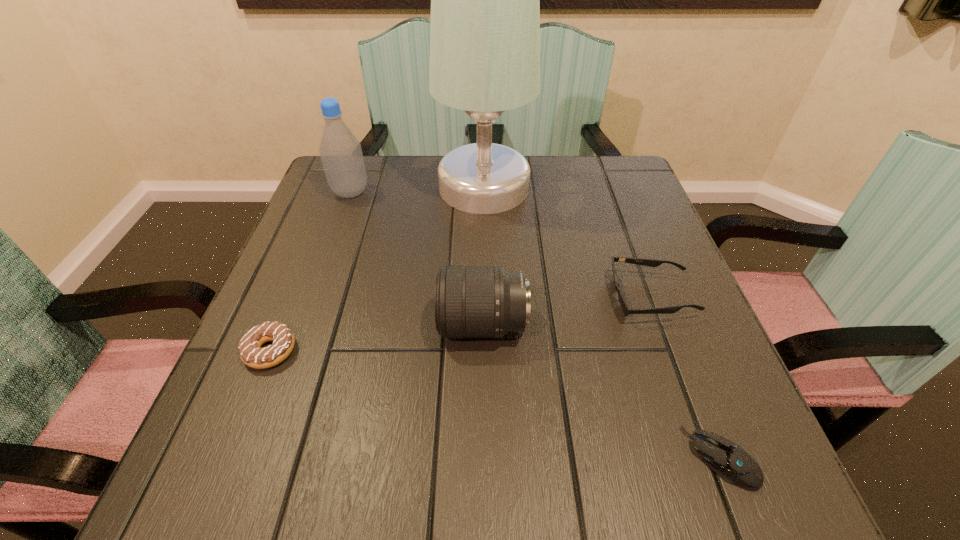
Image resolution: width=960 pixels, height=540 pixels. In the image, there is a desktop. In order to click on vacant space at the right edge in this screenshot , I will do `click(670, 293)`.

In the image, there is a desktop. Identify the location of blank space at the far left corner. The height and width of the screenshot is (540, 960). (313, 197).

Locate an element on the screen. The width and height of the screenshot is (960, 540). vacant space at the far right corner is located at coordinates (626, 205).

Locate an element on the screen. empty space that is in between the computer mouse and the tallest object is located at coordinates (602, 322).

Where is `free spot between the telephoto lens and the second tallest object`? The image size is (960, 540). free spot between the telephoto lens and the second tallest object is located at coordinates (417, 259).

At what (x,y) coordinates should I click in order to perform the action: click on vacant area that lies between the sunglasses and the nearest object. Please return your answer as a coordinate pair (x, y). Looking at the image, I should click on (685, 377).

Find the location of `vacant area that lies between the fourth tallest object and the tallest object`. vacant area that lies between the fourth tallest object and the tallest object is located at coordinates (567, 242).

Where is `vacant space that's between the second shortest object and the telephoto lens`? The height and width of the screenshot is (540, 960). vacant space that's between the second shortest object and the telephoto lens is located at coordinates (376, 338).

At what (x,y) coordinates should I click in order to perform the action: click on free space between the fifth shortest object and the second shortest object. Please return your answer as a coordinate pair (x, y). Looking at the image, I should click on (310, 272).

At what (x,y) coordinates should I click in order to perform the action: click on vacant space that is in between the fifth tallest object and the lampshade. Please return your answer as a coordinate pair (x, y). Looking at the image, I should click on (377, 269).